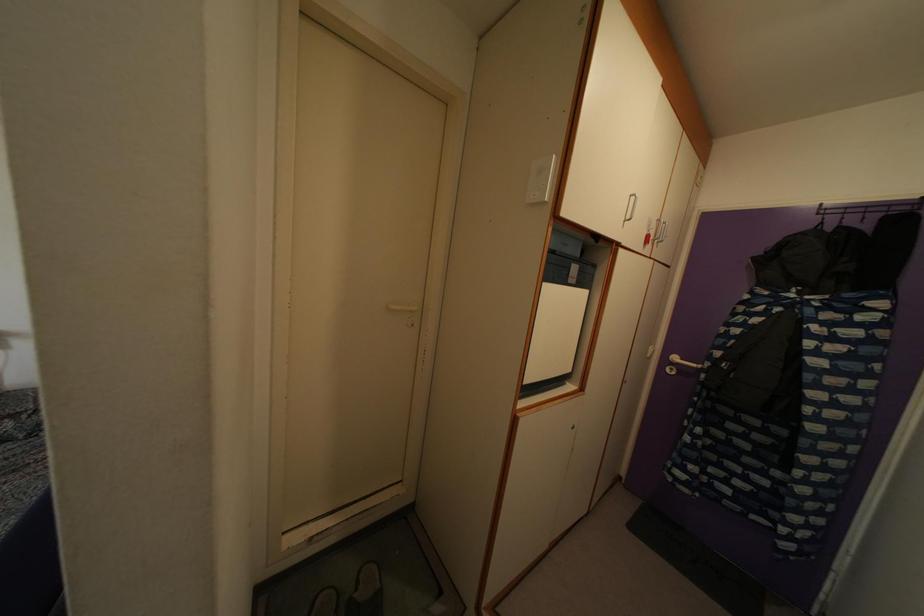
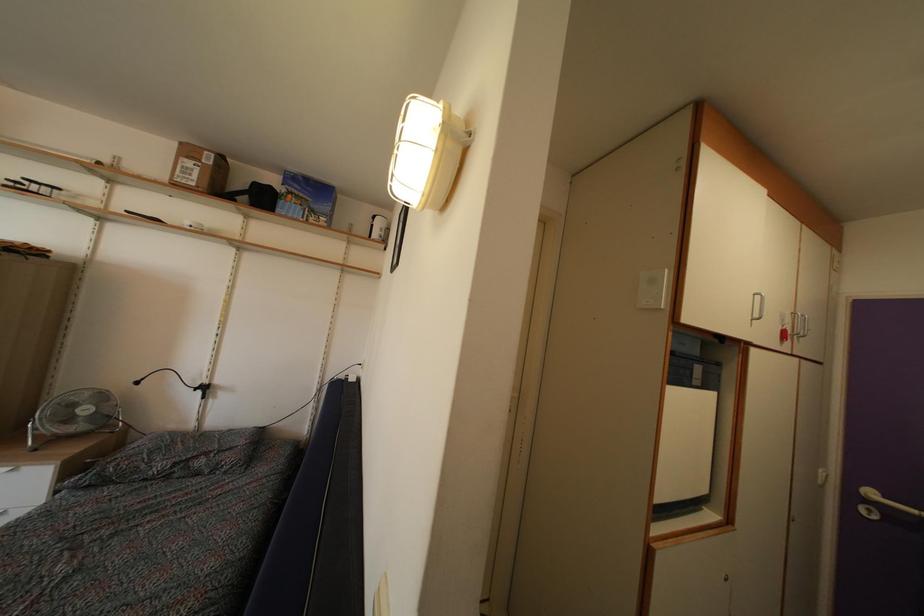
What movement of the cameraman would produce the second image?

The movement direction of the cameraman is left, backward.